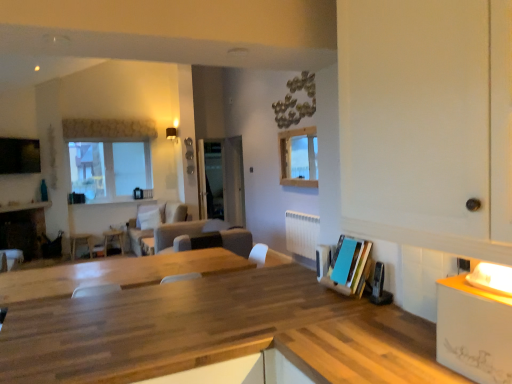
Measure the distance between wooden table at center and camera.

wooden table at center and camera are 22.23 feet apart from each other.

This screenshot has height=384, width=512. What do you see at coordinates (113, 240) in the screenshot? I see `wooden table at center` at bounding box center [113, 240].

This screenshot has width=512, height=384. What do you see at coordinates (80, 244) in the screenshot? I see `matte white chair at lower left` at bounding box center [80, 244].

What do you see at coordinates (202, 237) in the screenshot?
I see `suede-like gray couch at center, arranged as the first couch when viewed from the front` at bounding box center [202, 237].

Where is `clear glass window at upper center, which ranks as the first window in right-to-left order`? Image resolution: width=512 pixels, height=384 pixels. clear glass window at upper center, which ranks as the first window in right-to-left order is located at coordinates (298, 157).

Based on the photo, measure the distance between point (291, 161) and camera.

Point (291, 161) is 17.74 feet from camera.

This screenshot has height=384, width=512. Identify the location of suede beige couch at center, the 1th couch from the back. pos(153,222).

What are the coordinates of `white glossy counter at right` in the screenshot? It's located at (474, 331).

This screenshot has width=512, height=384. In order to click on wooden table at center in this screenshot , I will do `click(113, 240)`.

The image size is (512, 384). In order to click on glass door located above the matte black fireplace at left (from a real-world perspective) in this screenshot , I will do `click(214, 179)`.

In terms of width, does transparent glass door at center look wider or thinner when compared to matte black fireplace at left?

In the image, transparent glass door at center appears to be more narrow than matte black fireplace at left.

Considering the positions of objects transparent glass door at center and matte black fireplace at left in the image provided, who is behind, transparent glass door at center or matte black fireplace at left?

transparent glass door at center is more distant.

Which is more to the right, transparent glass door at center or matte black fireplace at left?

transparent glass door at center is more to the right.

Considering the sizes of clear glass window at upper center, acting as the first window starting from the front, and white glossy counter at right in the image, is clear glass window at upper center, acting as the first window starting from the front, wider or thinner than white glossy counter at right?

In the image, clear glass window at upper center, acting as the first window starting from the front, appears to be more narrow than white glossy counter at right.

From a real-world perspective, is clear glass window at upper center, which ranks as the first window in right-to-left order, positioned above or below white glossy counter at right?

Clearly, from a real-world perspective, clear glass window at upper center, which ranks as the first window in right-to-left order, is above white glossy counter at right.

How different are the orientations of clear glass window at upper center, which ranks as the first window in right-to-left order, and white glossy counter at right in degrees?

The facing directions of clear glass window at upper center, which ranks as the first window in right-to-left order, and white glossy counter at right are 91.6 degrees apart.

Looking at the image, does clear glass window at upper center, which ranks as the first window in right-to-left order, seem bigger or smaller compared to white glossy counter at right?

Considering their sizes, clear glass window at upper center, which ranks as the first window in right-to-left order, takes up more space than white glossy counter at right.

From a real-world perspective, is white plastic radiator at center on transparent glass door at center?

No, from a real-world perspective, white plastic radiator at center is not over transparent glass door at center

Is there a large distance between white plastic radiator at center and transparent glass door at center?

Yes, white plastic radiator at center and transparent glass door at center are located far from each other.

Is white plastic radiator at center looking in the opposite direction of transparent glass door at center?

white plastic radiator at center is not turned away from transparent glass door at center.

Is white plastic radiator at center outside of transparent glass door at center?

Yes.

In the scene shown: Who is bigger, white plastic radiator at center or suede-like gray couch at center, arranged as the first couch when viewed from the front?

Bigger between the two is suede-like gray couch at center, arranged as the first couch when viewed from the front.

Is white plastic radiator at center wider than suede-like gray couch at center, arranged as the first couch when viewed from the front?

Incorrect, the width of white plastic radiator at center does not surpass that of suede-like gray couch at center, arranged as the first couch when viewed from the front.

From a real-world perspective, which object stands above the other?

white plastic radiator at center.

Is matte black fireplace at left surrounded by matte white chair at lower left?

No, matte white chair at lower left does not contain matte black fireplace at left.

Based on the photo, which object is further away from the camera, matte white chair at lower left or matte black fireplace at left?

matte white chair at lower left is further from the camera.

Does point (72, 242) lie behind point (45, 231)?

That is True.

From the image's perspective, is blue hardcover book at right located above or below clear glass window at upper center, the second window from the back?

Clearly, from the image's perspective, blue hardcover book at right is below clear glass window at upper center, the second window from the back.

Does blue hardcover book at right turn towards clear glass window at upper center, the second window from the left?

No, blue hardcover book at right is not aimed at clear glass window at upper center, the second window from the left.

There is a blue hardcover book at right. What are the coordinates of `the 2nd window above it (from a real-world perspective)` in the screenshot? It's located at (298, 157).

Is point (38, 229) positioned behind point (469, 375)?

That is True.

Where is `counter lying on the right of matte black fireplace at left`? counter lying on the right of matte black fireplace at left is located at coordinates (474, 331).

In the scene shown: Would you say matte black fireplace at left contains white glossy counter at right?

Definitely not — white glossy counter at right is not inside matte black fireplace at left.

Is matte black fireplace at left facing away from white glossy counter at right?

matte black fireplace at left does not have its back to white glossy counter at right.

I want to click on fireplace below the transparent glass door at center (from the image's perspective), so click(23, 228).

Image resolution: width=512 pixels, height=384 pixels. I want to click on counter in front of the clear glass window at upper center, the second window from the back, so click(x=474, y=331).

Which object lies further to the anchor point white glossy counter at right, white frosted glass window at upper left, the second window in the right-to-left sequence, or transparent glass door at center?

Based on the image, white frosted glass window at upper left, the second window in the right-to-left sequence, appears to be further to white glossy counter at right.

When comparing their distances from white plastic radiator at center, does white frosted glass window at upper left, the 2th window viewed from the front, or suede-like gray couch at center, which appears as the second couch when viewed from the back, seem closer?

suede-like gray couch at center, which appears as the second couch when viewed from the back, is closer to white plastic radiator at center.

Considering their positions, is wooden table at center positioned closer to transparent glass door at center than clear glass window at upper center, acting as the first window starting from the front?

clear glass window at upper center, acting as the first window starting from the front, is positioned closer to the anchor transparent glass door at center.

When comparing their distances from suede beige couch at center, the 1th couch from the back, does white frosted glass window at upper left, which is the 1th window from back to front, or transparent glass door at center seem closer?

The object closer to suede beige couch at center, the 1th couch from the back, is transparent glass door at center.

Estimate the real-world distances between objects in this image. Which object is further from blue hardcover book at right, suede beige couch at center, the 1th couch from the back, or suede-like gray couch at center, arranged as the first couch when viewed from the front?

suede beige couch at center, the 1th couch from the back, lies further to blue hardcover book at right than the other object.

Estimate the real-world distances between objects in this image. Which object is closer to matte white chair at lower left, white frosted glass window at upper left, the 2th window viewed from the front, or matte black fireplace at left?

Based on the image, matte black fireplace at left appears to be nearer to matte white chair at lower left.

From the image, which object appears to be farther from blue hardcover book at right, wooden table at center or matte white chair at lower left?

matte white chair at lower left is further to blue hardcover book at right.

Considering their positions, is clear glass window at upper center, the second window from the back, positioned further to white plastic radiator at center than wooden table at center?

wooden table at center.

You are a GUI agent. You are given a task and a screenshot of the screen. Output one action in this format:
    pyautogui.click(x=<x>, y=<y>)
    Task: Click on the glass door located between matte black fireplace at left and white plastic radiator at center in the left-right direction
    The height and width of the screenshot is (384, 512).
    Given the screenshot: What is the action you would take?
    pyautogui.click(x=214, y=179)

The width and height of the screenshot is (512, 384). What are the coordinates of `chair positioned between white glossy counter at right and white frosted glass window at upper left, the 2th window viewed from the front, from near to far` in the screenshot? It's located at (80, 244).

This screenshot has width=512, height=384. I want to click on radiator positioned between blue hardcover book at right and matte white chair at lower left from near to far, so click(302, 233).

Locate an element on the screen. The image size is (512, 384). couch between matte white chair at lower left and transparent glass door at center is located at coordinates (153, 222).